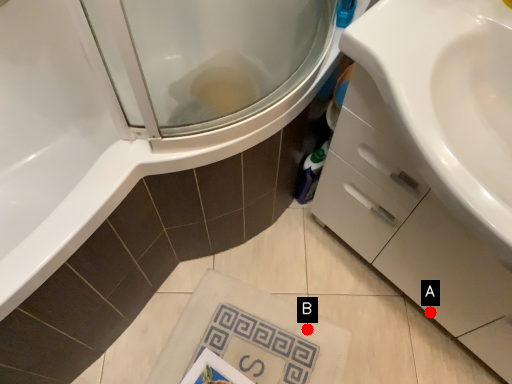
Question: Two points are circled on the image, labeled by A and B beside each circle. Which point is farther to the camera?

Choices:
 (A) A is further
 (B) B is further

Answer: (B)